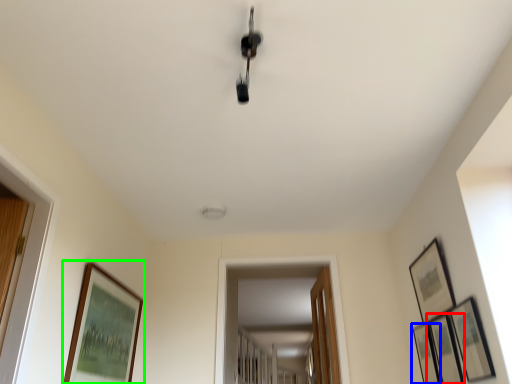
Question: Estimate the real-world distances between objects in this image. Which object is farther from picture frame (highlighted by a red box), picture frame (highlighted by a blue box) or picture frame (highlighted by a green box)?

Choices:
 (A) picture frame
 (B) picture frame

Answer: (B)